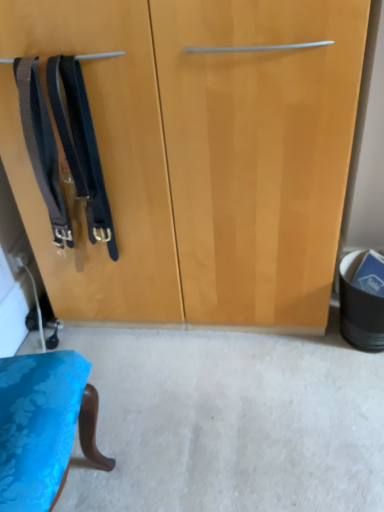
Question: From a real-world perspective, is black leather suspenders at left, which is the second suspenders in right-to-left order, positioned above or below black matte suspenders at left, which is the 1th suspenders in right-to-left order?

Choices:
 (A) above
 (B) below

Answer: (A)

Question: Considering their positions, is black leather suspenders at left, positioned as the 1th suspenders in left-to-right order, located in front of or behind black matte suspenders at left, the 2th suspenders positioned from the left?

Choices:
 (A) behind
 (B) front

Answer: (A)

Question: Which is correct: black leather suspenders at left, which is the second suspenders in right-to-left order, is inside black matte suspenders at left, the 2th suspenders positioned from the left, or outside of it?

Choices:
 (A) inside
 (B) outside

Answer: (B)

Question: Considering their positions, is black matte suspenders at left, the 2th suspenders positioned from the left, located in front of or behind black leather suspenders at left, positioned as the 1th suspenders in left-to-right order?

Choices:
 (A) front
 (B) behind

Answer: (A)

Question: Choose the correct answer: Is black matte suspenders at left, the 2th suspenders positioned from the left, inside black leather suspenders at left, positioned as the 1th suspenders in left-to-right order, or outside it?

Choices:
 (A) outside
 (B) inside

Answer: (A)

Question: Considering the positions of black matte suspenders at left, the 2th suspenders positioned from the left, and black leather suspenders at left, which is the second suspenders in right-to-left order, in the image, is black matte suspenders at left, the 2th suspenders positioned from the left, taller or shorter than black leather suspenders at left, which is the second suspenders in right-to-left order,?

Choices:
 (A) tall
 (B) short

Answer: (A)

Question: Is point (62, 104) closer or farther from the camera than point (43, 187)?

Choices:
 (A) farther
 (B) closer

Answer: (B)